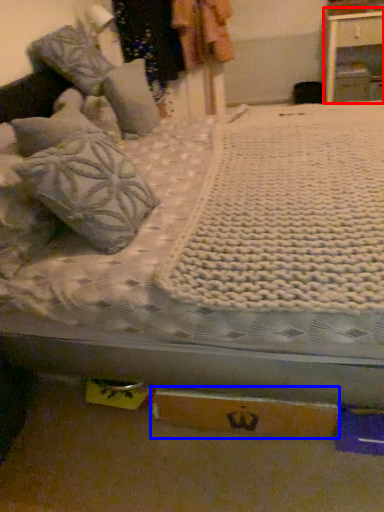
Question: Which of the following is the farthest to the observer, nightstand (highlighted by a red box) or cardboard box (highlighted by a blue box)?

Choices:
 (A) nightstand
 (B) cardboard box

Answer: (A)